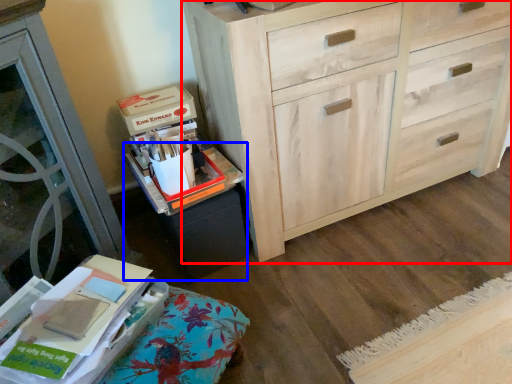
Question: Which of the following is the closest to the observer, chest of drawers (highlighted by a red box) or cabinetry (highlighted by a blue box)?

Choices:
 (A) chest of drawers
 (B) cabinetry

Answer: (A)